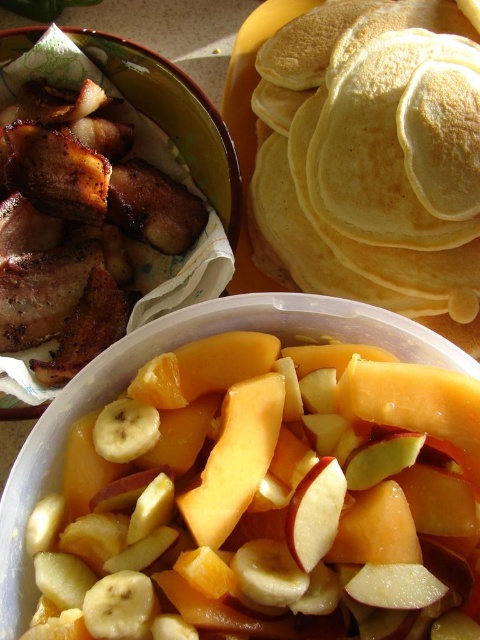
Question: Where is sliced orange at center located in relation to yellow matte banana at center in the image?

Choices:
 (A) left
 (B) right

Answer: (B)

Question: Does sliced orange at center have a greater width compared to yellow matte banana at center?

Choices:
 (A) no
 (B) yes

Answer: (B)

Question: Is sliced orange at center closer to the viewer compared to red matte apple at center?

Choices:
 (A) no
 (B) yes

Answer: (B)

Question: Which point is farther to the camera?

Choices:
 (A) (285, 508)
 (B) (119, 401)

Answer: (B)

Question: Which object is closer to the camera taking this photo?

Choices:
 (A) yellow matte banana at center
 (B) red matte apple at center

Answer: (B)

Question: Which of the following is the closest to the observer?

Choices:
 (A) (126, 422)
 (B) (333, 502)

Answer: (B)